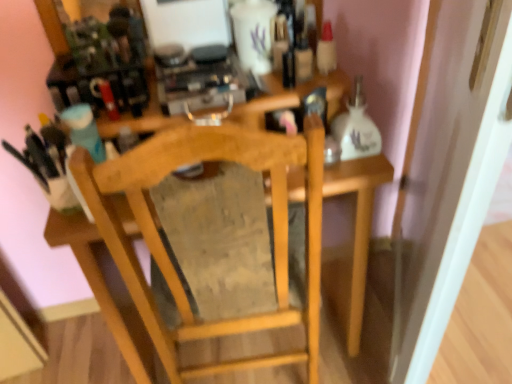
Locate an element on the screen. The width and height of the screenshot is (512, 384). vacant space to the right of white glossy door at right is located at coordinates (478, 321).